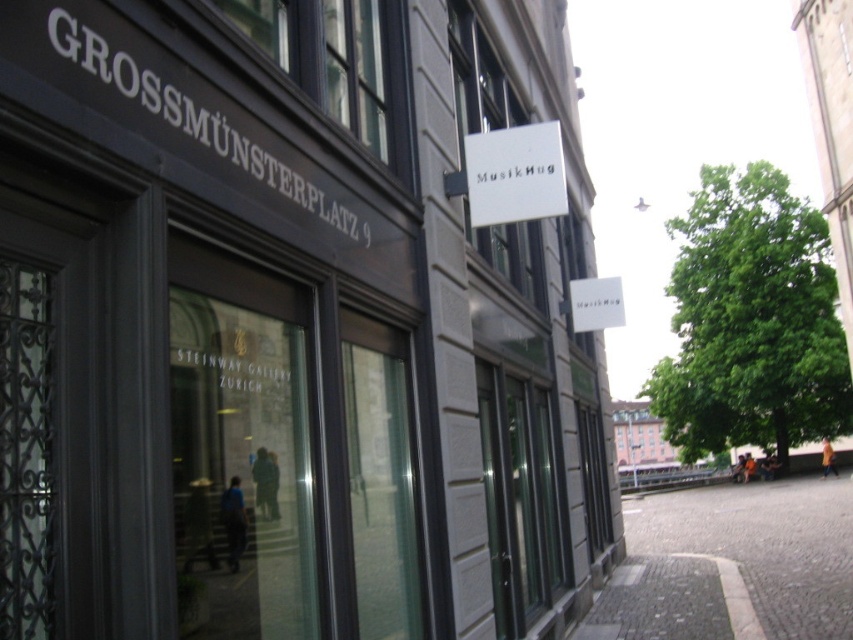
Question: Is matte gray building at center smaller than gray cobblestone pavement at lower right?

Choices:
 (A) yes
 (B) no

Answer: (A)

Question: Is matte gray building at center positioned before gray cobblestone pavement at lower right?

Choices:
 (A) yes
 (B) no

Answer: (A)

Question: Does matte gray building at center appear on the right side of gray cobblestone pavement at lower right?

Choices:
 (A) no
 (B) yes

Answer: (A)

Question: Which object appears closest to the camera in this image?

Choices:
 (A) gray cobblestone pavement at lower right
 (B) matte gray building at center

Answer: (B)

Question: Among these objects, which one is nearest to the camera?

Choices:
 (A) matte gray building at center
 (B) gray cobblestone pavement at lower right

Answer: (A)